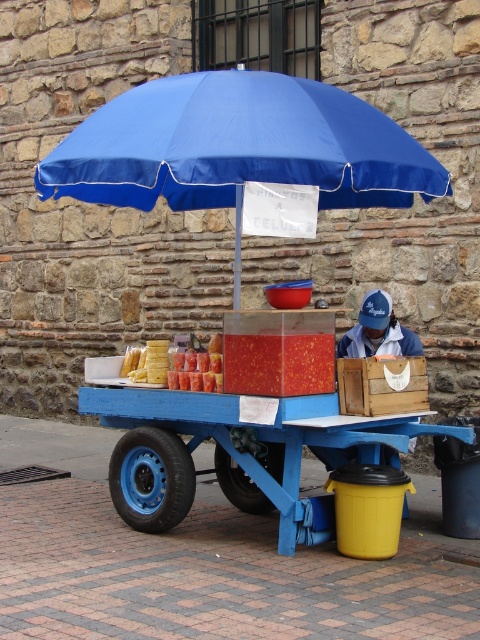
Between blue fabric umbrella at upper center and wooden crate at center, which one appears on the left side from the viewer's perspective?

blue fabric umbrella at upper center is more to the left.

Does blue fabric umbrella at upper center lie in front of wooden crate at center?

Yes, it is.

Who is more distant from viewer, (279,172) or (382,392)?

The point (382,392) is behind.

Find the location of a particular element. The width and height of the screenshot is (480, 640). blue fabric umbrella at upper center is located at coordinates (239, 147).

Is blue wooden cart at center wider than wooden crate at center?

Yes.

Is point (305, 403) less distant than point (384, 372)?

Yes, point (305, 403) is in front of point (384, 372).

Find the location of a particular element. The width and height of the screenshot is (480, 640). blue wooden cart at center is located at coordinates point(228,448).

Who is positioned more to the left, blue fabric umbrella at upper center or blue wooden cart at center?

blue fabric umbrella at upper center

Does point (120, 164) lie behind point (456, 435)?

That is False.

Describe the element at coordinates (239, 147) in the screenshot. I see `blue fabric umbrella at upper center` at that location.

Find the location of a particular element. The width and height of the screenshot is (480, 640). blue fabric umbrella at upper center is located at coordinates (239, 147).